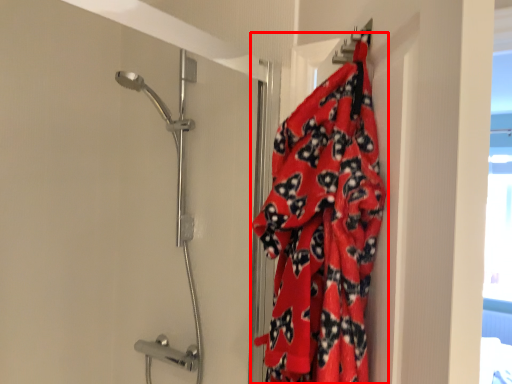
Question: From the image's perspective, what is the correct spatial relationship of blanket (annotated by the red box) in relation to shower door?

Choices:
 (A) above
 (B) below

Answer: (A)